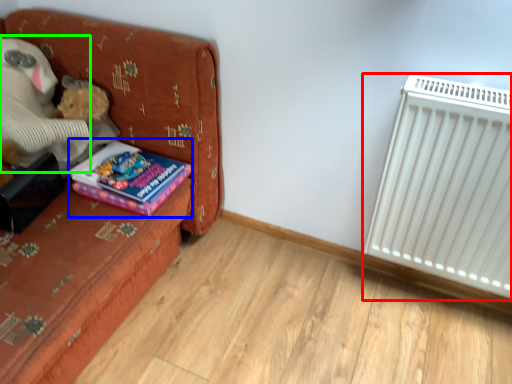
Question: Based on their relative distances, which object is nearer to radiator (highlighted by a red box)? Choose from book (highlighted by a blue box) and teddy (highlighted by a green box).

Choices:
 (A) book
 (B) teddy

Answer: (A)